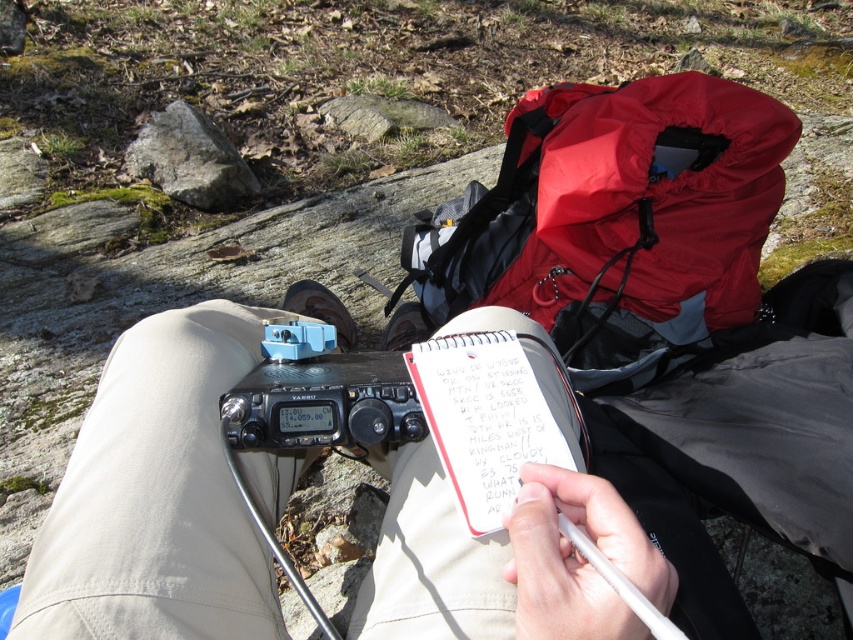
Question: Which point is closer to the camera taking this photo?

Choices:
 (A) (x=525, y=602)
 (B) (x=473, y=396)
 (C) (x=350, y=364)
 (D) (x=763, y=163)

Answer: (A)

Question: Is white plastic pen at center smaller than black plastic radio at center?

Choices:
 (A) yes
 (B) no

Answer: (A)

Question: Which point appears closest to the camera in this image?

Choices:
 (A) (675, 339)
 (B) (344, 371)

Answer: (B)

Question: Can you confirm if white paper notepad at center is bigger than white plastic pen at center?

Choices:
 (A) yes
 (B) no

Answer: (A)

Question: Among these objects, which one is nearest to the camera?

Choices:
 (A) black plastic radio at center
 (B) white paper notepad at center

Answer: (B)

Question: Is white paper notepad at center wider than white plastic pen at center?

Choices:
 (A) no
 (B) yes

Answer: (B)